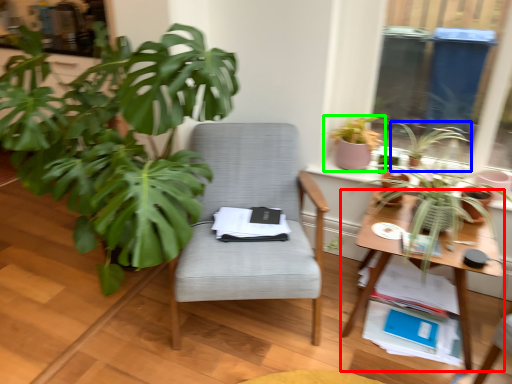
Question: Which object is positioned farthest from table (highlighted by a red box)? Select from houseplant (highlighted by a blue box) and houseplant (highlighted by a green box).

Choices:
 (A) houseplant
 (B) houseplant

Answer: (B)